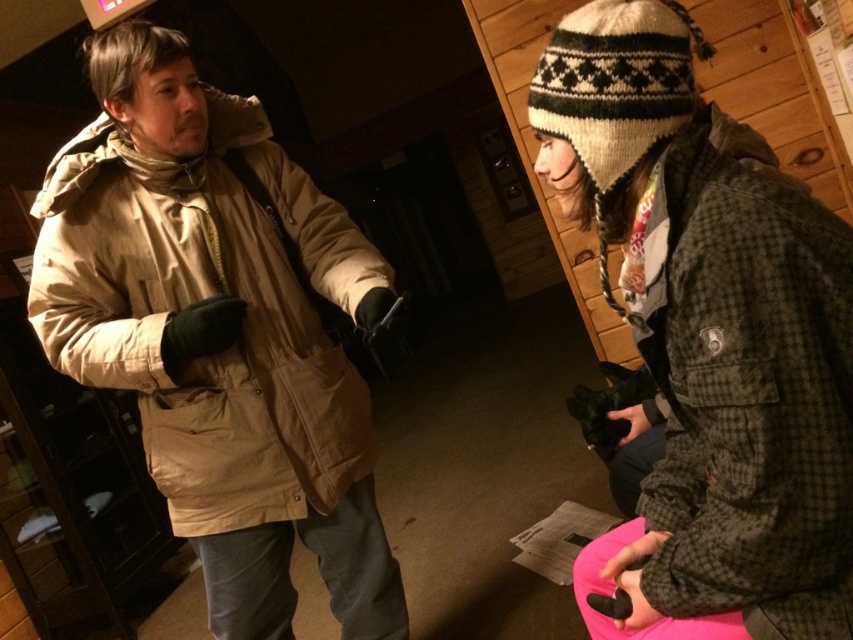
Can you confirm if beige cotton jacket at left is positioned to the right of knitted woolen hat at upper right?

In fact, beige cotton jacket at left is to the left of knitted woolen hat at upper right.

Between point (173, 118) and point (633, 170), which one is positioned in front?

Positioned in front is point (633, 170).

At what (x,y) coordinates should I click in order to perform the action: click on beige cotton jacket at left. Please return your answer as a coordinate pair (x, y). The image size is (853, 640). Looking at the image, I should click on pyautogui.click(x=219, y=333).